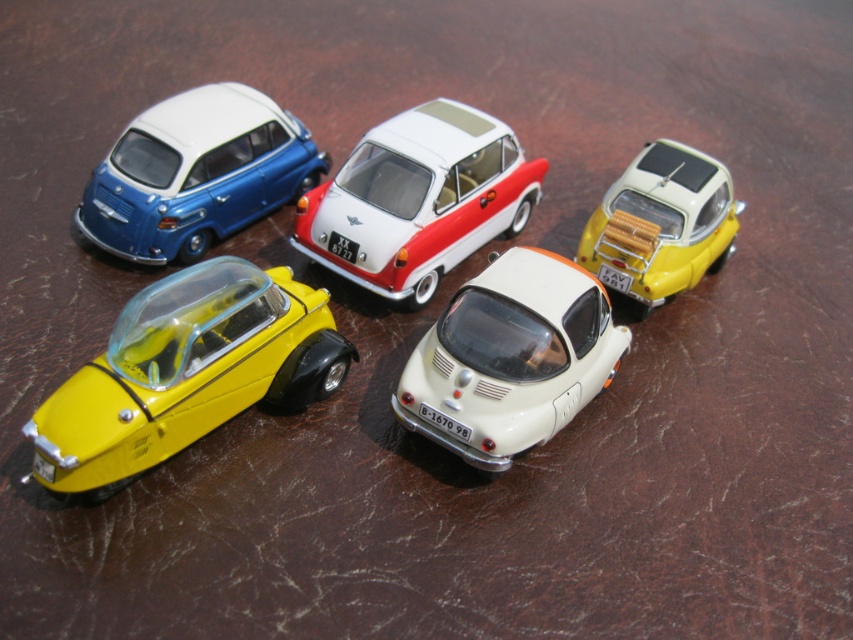
You are looking at the arrangement of the matte blue car at upper left and the yellow matte toy car at upper right. Which one is positioned more to the left side of the image?

The matte blue car at upper left is positioned more to the left side of the image than the yellow matte toy car at upper right.

You are a child playing with these toy cars. You want to stack the yellow matte toy car at lower left on top of the yellow matte toy car at upper right. Will the lower one fit on the upper one?

The yellow matte toy car at lower left is taller than the yellow matte toy car at upper right, so it cannot fit on top since it is taller.

Which car is located at the point with coordinates (196, 173)?

The point with coordinates (196, 173) corresponds to the matte blue car at upper left.